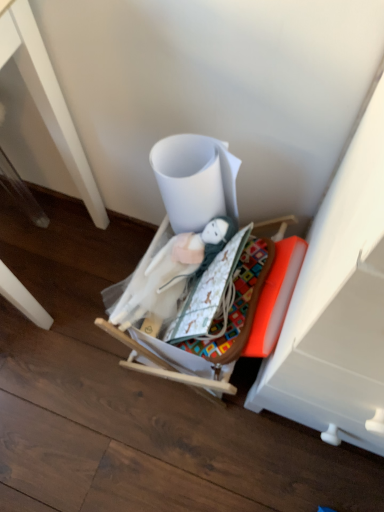
Measure the distance between point (53, 99) and camera.

Point (53, 99) and camera are 34.72 inches apart from each other.

The width and height of the screenshot is (384, 512). Describe the element at coordinates (48, 99) in the screenshot. I see `white wood rocking chair at lower left` at that location.

I want to click on white wood rocking chair at lower left, so click(48, 99).

Measure the distance between white wood rocking chair at lower left and camera.

white wood rocking chair at lower left and camera are 66.40 centimeters apart.

Locate an element on the screen. Image resolution: width=384 pixels, height=512 pixels. white wood rocking chair at lower left is located at coordinates (48, 99).